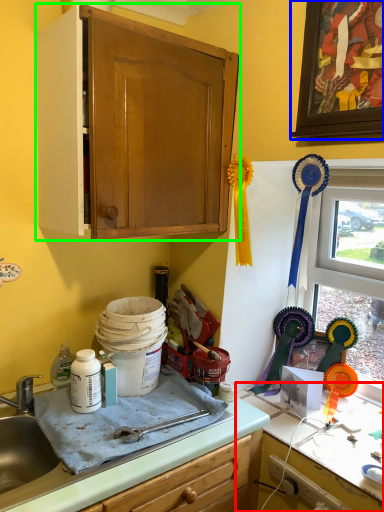
Question: Based on their relative distances, which object is nearer to countertop (highlighted by a red box)? Choose from picture frame (highlighted by a blue box) and cabinetry (highlighted by a green box).

Choices:
 (A) picture frame
 (B) cabinetry

Answer: (B)